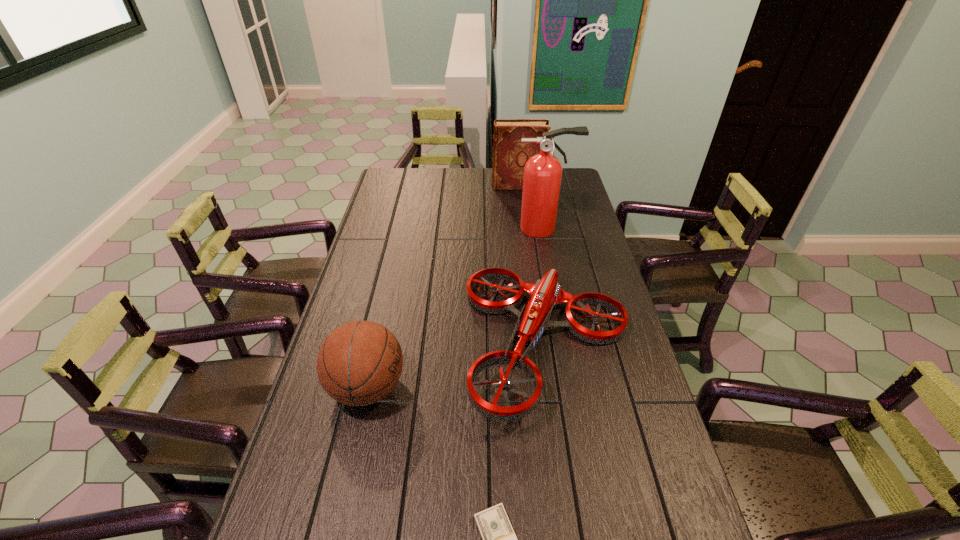
At what (x,y) coordinates should I click in order to perform the action: click on free spot located 0.070m on the spine side of the farthest object. Please return your answer as a coordinate pair (x, y). Looking at the image, I should click on (476, 186).

The height and width of the screenshot is (540, 960). What are the coordinates of `free space located on the side with brand label of the leftmost object` in the screenshot? It's located at (538, 388).

Identify the location of vacant point located on the front of the second shortest object. click(x=569, y=480).

This screenshot has height=540, width=960. Identify the location of object located in the far edge section of the desktop. (510, 154).

You are a GUI agent. You are given a task and a screenshot of the screen. Output one action in this format:
    pyautogui.click(x=<x>, y=<y>)
    Task: Click on the object that is at the left edge
    
    Given the screenshot: What is the action you would take?
    pyautogui.click(x=359, y=363)

Where is `fire extinguisher located in the right edge section of the desktop`? The image size is (960, 540). fire extinguisher located in the right edge section of the desktop is located at coordinates (542, 172).

The height and width of the screenshot is (540, 960). In order to click on hardback book located in the right edge section of the desktop in this screenshot , I will do `click(510, 154)`.

Locate an element on the screen. This screenshot has width=960, height=540. drone situated at the right edge is located at coordinates (546, 293).

The height and width of the screenshot is (540, 960). I want to click on object situated at the far right corner, so point(510,154).

Image resolution: width=960 pixels, height=540 pixels. Identify the location of free space at the left edge of the desktop. (396, 271).